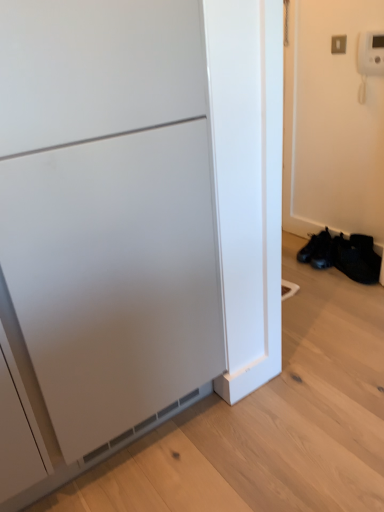
You are a GUI agent. You are given a task and a screenshot of the screen. Output one action in this format:
    pyautogui.click(x=<x>, y=<y>)
    Task: Click on the black mesh shoe at lower right
    
    Given the screenshot: What is the action you would take?
    pyautogui.click(x=357, y=258)

What do you see at coordinates (357, 258) in the screenshot? I see `black mesh shoe at lower right` at bounding box center [357, 258].

Where is `black leather shoes at lower right`? The image size is (384, 512). black leather shoes at lower right is located at coordinates (317, 251).

What do you see at coordinates (108, 208) in the screenshot?
I see `matte white cabinet at left` at bounding box center [108, 208].

This screenshot has height=512, width=384. In order to click on black mesh shoe at lower right in this screenshot , I will do `click(357, 258)`.

Which of these two, black mesh shoe at lower right or black leather shoes at lower right, stands taller?

With more height is black mesh shoe at lower right.

Is black mesh shoe at lower right oriented away from black leather shoes at lower right?

No, black mesh shoe at lower right's orientation is not away from black leather shoes at lower right.

In the scene shown: Are black mesh shoe at lower right and black leather shoes at lower right beside each other?

black mesh shoe at lower right is not next to black leather shoes at lower right, and they're not touching.

From the image's perspective, between black mesh shoe at lower right and black leather shoes at lower right, which one is located above?

From the image's view, black leather shoes at lower right is above.

From the picture: Which is more to the left, black leather shoes at lower right or black mesh shoe at lower right?

From the viewer's perspective, black leather shoes at lower right appears more on the left side.

Is black leather shoes at lower right taller than black mesh shoe at lower right?

Incorrect, the height of black leather shoes at lower right is not larger of that of black mesh shoe at lower right.

Does black leather shoes at lower right have a larger size compared to black mesh shoe at lower right?

Incorrect, black leather shoes at lower right is not larger than black mesh shoe at lower right.

From the picture: Can you confirm if matte white cabinet at left is thinner than black leather shoes at lower right?

In fact, matte white cabinet at left might be wider than black leather shoes at lower right.

Based on their sizes in the image, would you say matte white cabinet at left is bigger or smaller than black leather shoes at lower right?

Considering their sizes, matte white cabinet at left takes up more space than black leather shoes at lower right.

From a real-world perspective, who is located lower, matte white cabinet at left or black leather shoes at lower right?

From a 3D spatial view, black leather shoes at lower right is below.

Is there a large distance between matte white cabinet at left and black leather shoes at lower right?

That's right, there is a large distance between matte white cabinet at left and black leather shoes at lower right.

Which is correct: black leather shoes at lower right is inside matte white cabinet at left, or outside of it?

black leather shoes at lower right lies outside matte white cabinet at left.

Are black leather shoes at lower right and matte white cabinet at left making contact?

No, black leather shoes at lower right is not beside matte white cabinet at left.

Which object is more forward, black leather shoes at lower right or matte white cabinet at left?

matte white cabinet at left is more forward.

Is point (327, 266) farther from camera compared to point (21, 112)?

Yes, it is.

From a real-world perspective, is black mesh shoe at lower right physically above matte white cabinet at left?

No, from a real-world perspective, black mesh shoe at lower right is not on top of matte white cabinet at left.

Based on the photo, considering the sizes of objects black mesh shoe at lower right and matte white cabinet at left in the image provided, who is shorter, black mesh shoe at lower right or matte white cabinet at left?

With less height is black mesh shoe at lower right.

Which is farther from the camera, (x=340, y=245) or (x=166, y=383)?

The point (x=340, y=245) is farther.

How much distance is there between black mesh shoe at lower right and matte white cabinet at left?

black mesh shoe at lower right is 5.01 feet away from matte white cabinet at left.

From a real-world perspective, does matte white cabinet at left sit lower than black mesh shoe at lower right?

No, from a real-world perspective, matte white cabinet at left is not under black mesh shoe at lower right.

Can black mesh shoe at lower right be found inside matte white cabinet at left?

No, matte white cabinet at left does not contain black mesh shoe at lower right.

Does point (85, 328) come farther from viewer compared to point (349, 274)?

That is False.

I want to click on footwear above the black mesh shoe at lower right (from the image's perspective), so click(x=317, y=251).

Where is `shoe on the right side of black leather shoes at lower right`? The width and height of the screenshot is (384, 512). shoe on the right side of black leather shoes at lower right is located at coordinates (357, 258).

Estimate the real-world distances between objects in this image. Which object is further from black leather shoes at lower right, black mesh shoe at lower right or matte white cabinet at left?

matte white cabinet at left is further to black leather shoes at lower right.

When comparing their distances from matte white cabinet at left, does black mesh shoe at lower right or black leather shoes at lower right seem closer?

black mesh shoe at lower right is positioned closer to the anchor matte white cabinet at left.

When comparing their distances from matte white cabinet at left, does black leather shoes at lower right or black mesh shoe at lower right seem further?

Based on the image, black leather shoes at lower right appears to be further to matte white cabinet at left.

Looking at the image, which one is located further to black mesh shoe at lower right, matte white cabinet at left or black leather shoes at lower right?

Among the two, matte white cabinet at left is located further to black mesh shoe at lower right.

When comparing their distances from black mesh shoe at lower right, does black leather shoes at lower right or matte white cabinet at left seem further?

matte white cabinet at left lies further to black mesh shoe at lower right than the other object.

When comparing their distances from black leather shoes at lower right, does matte white cabinet at left or black mesh shoe at lower right seem closer?

black mesh shoe at lower right.

The width and height of the screenshot is (384, 512). Identify the location of shoe located between matte white cabinet at left and black leather shoes at lower right in the depth direction. pyautogui.click(x=357, y=258).